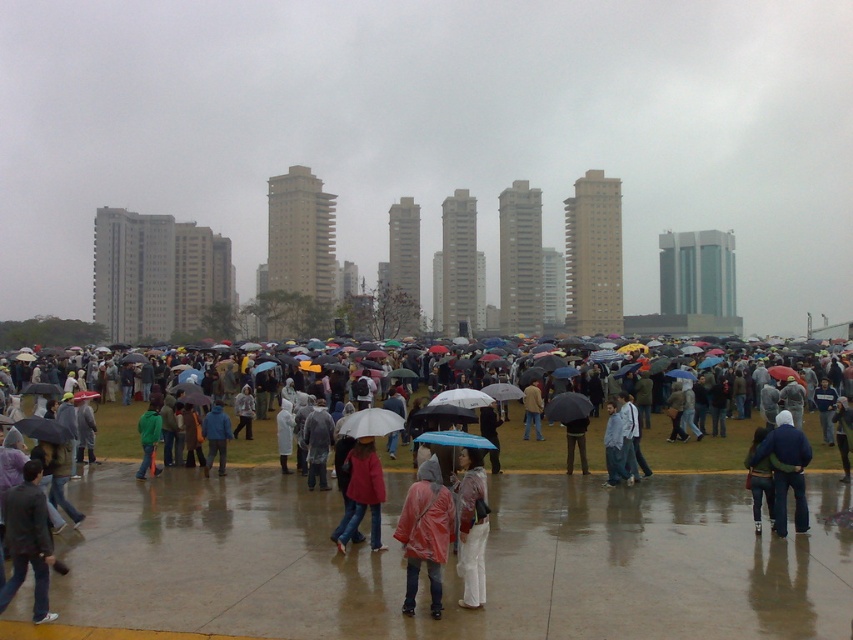
Question: Estimate the real-world distances between objects in this image. Which object is farther from the dark gray jacket at lower left?

Choices:
 (A) rubberized red raincoat at center
 (B) blue denim jacket at lower right

Answer: (B)

Question: Where is rubberized red raincoat at center located in relation to raincoatwaterproofperson at center in the image?

Choices:
 (A) left
 (B) right

Answer: (A)

Question: In this image, where is raincoats at center located relative to blue denim jacket at lower right?

Choices:
 (A) left
 (B) right

Answer: (A)

Question: Which object is closer to the camera taking this photo?

Choices:
 (A) raincoats at center
 (B) dark gray jacket at lower left

Answer: (B)

Question: Can you confirm if raincoats at center is bigger than dark gray jacket at lower left?

Choices:
 (A) no
 (B) yes

Answer: (B)

Question: Based on their relative distances, which object is farther from the red matte jacket at center?

Choices:
 (A) raincoats at center
 (B) raincoatwaterproofperson at center
 (C) rubberized red raincoat at center

Answer: (A)